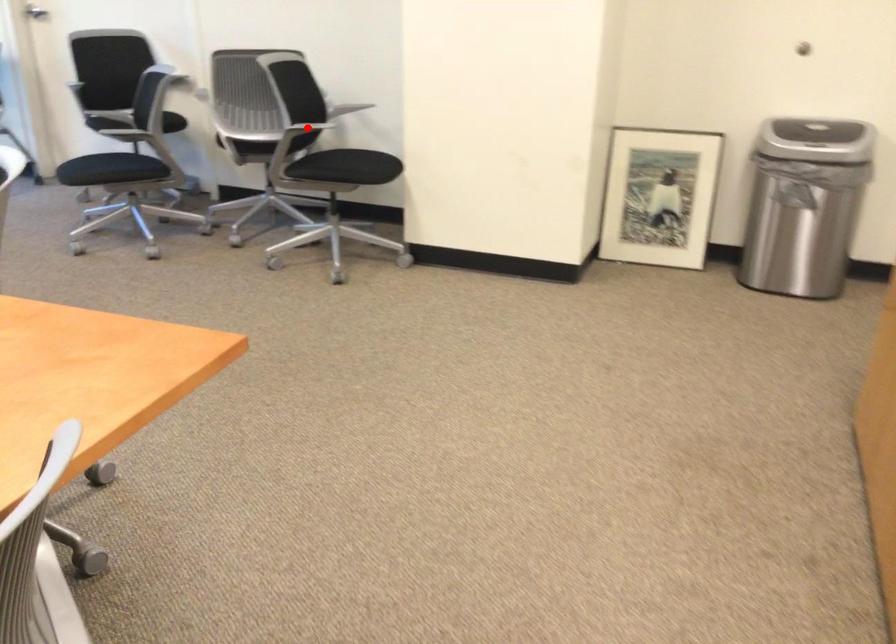
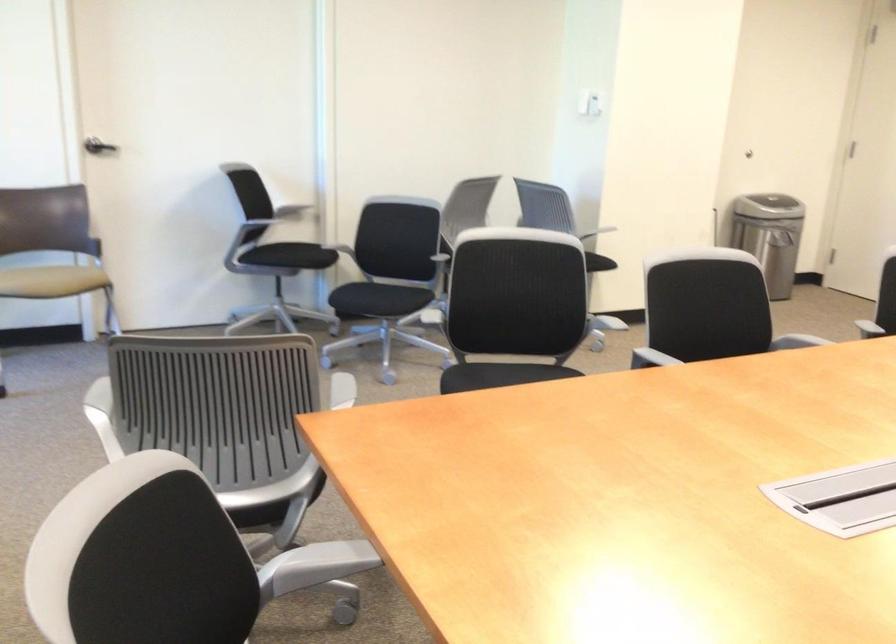
Question: I am providing you with two images of the same scene from different viewpoints. A red point is marked on the first image. At the location where the point appears in image 1, is it still visible in image 2?

Choices:
 (A) Yes
 (B) No

Answer: (B)